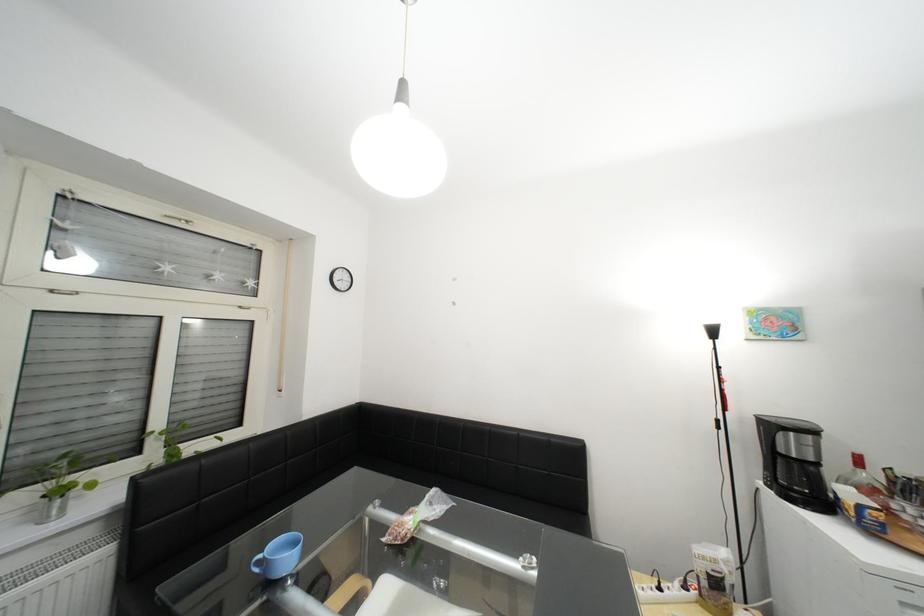
Where is `red-capped bottle`? The image size is (924, 616). red-capped bottle is located at coordinates (864, 480).